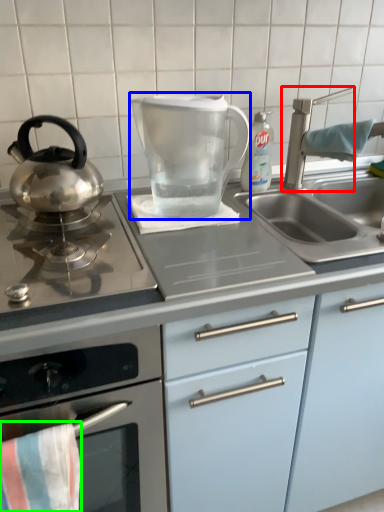
Question: Which is farther away from tap (highlighted by a red box)? kitchen appliance (highlighted by a blue box) or beach towel (highlighted by a green box)?

Choices:
 (A) kitchen appliance
 (B) beach towel

Answer: (B)